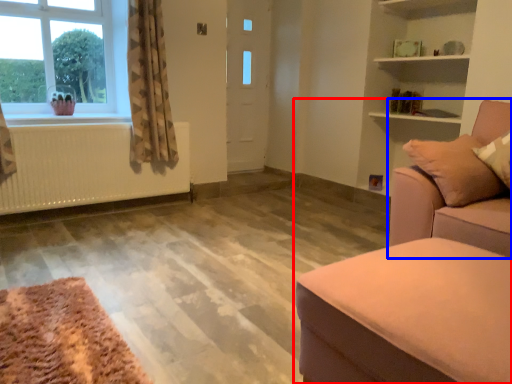
Question: Which object is further to the camera taking this photo, studio couch (highlighted by a red box) or studio couch (highlighted by a blue box)?

Choices:
 (A) studio couch
 (B) studio couch

Answer: (B)